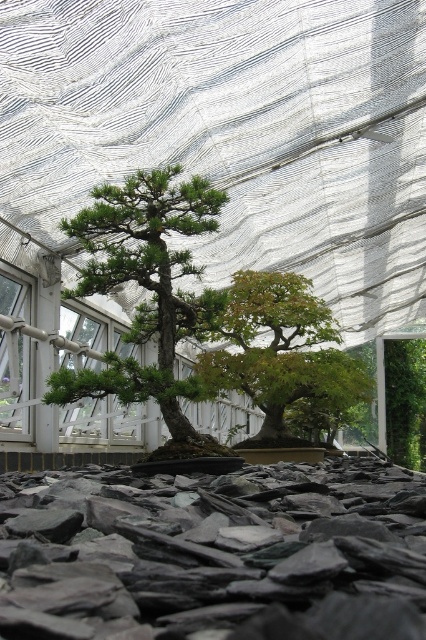
You are a gardener who wants to water the bonsai trees. You have a watering can in your left hand and need to reach both the green matte bonsai at center and the green glossy bonsai at center. Which bonsai should you water first to avoid getting the glossy one wet when watering the matte one?

You should water the green glossy bonsai at center first. Since the green matte bonsai at center is in front of the green glossy bonsai at center, watering the glossy one first will prevent water from dripping onto it when you water the matte bonsai afterward.

You are designing a miniature garden and need to place both the dark gray slate at center and the green glossy bonsai at center. Which object takes up more space in the garden?

The green glossy bonsai at center takes up more space than the dark gray slate at center.

You are standing in the greenhouse and want to water the bonsai tree located at point [23,570]. If your watering can has a maximum reach of 30 inches, will you be able to water the bonsai without moving closer?

The distance between you and the bonsai tree at point [23,570] is 28.86 inches, which is within the watering can reach of 30 inches. Therefore, you can water the bonsai without moving closer.